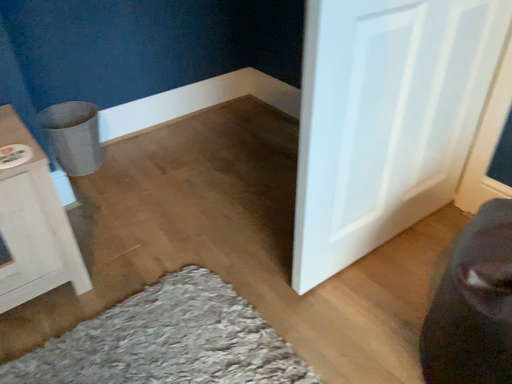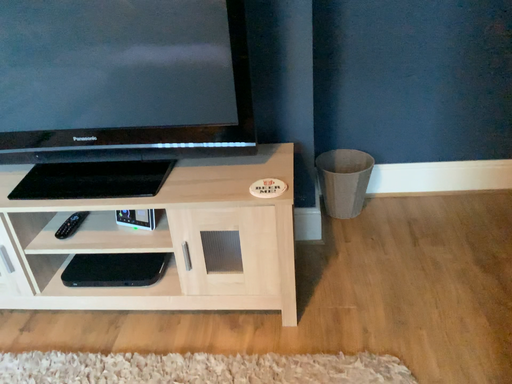
Question: Which way did the camera rotate in the video?

Choices:
 (A) rotated downward
 (B) rotated upward

Answer: (B)